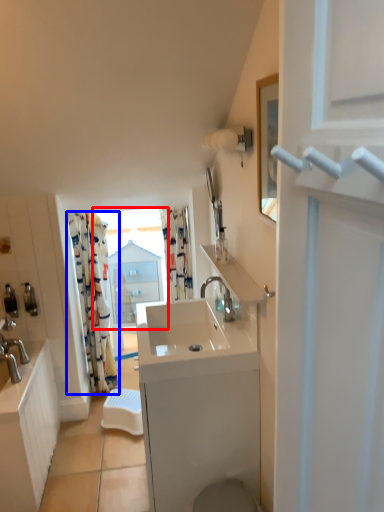
Question: Which object is closer to the camera taking this photo, window (highlighted by a red box) or curtain (highlighted by a blue box)?

Choices:
 (A) window
 (B) curtain

Answer: (B)